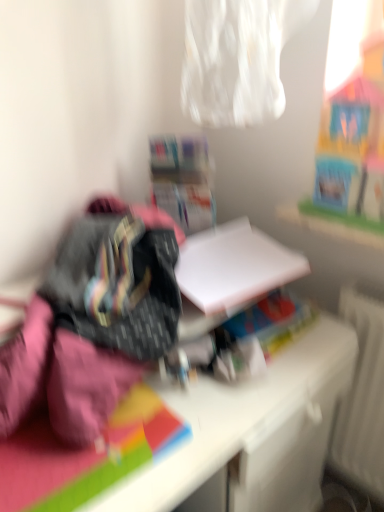
Question: Can white matte paper at center be found inside white cardboard box at center?

Choices:
 (A) no
 (B) yes

Answer: (A)

Question: Does white cardboard box at center come behind white matte paper at center?

Choices:
 (A) no
 (B) yes

Answer: (B)

Question: Does white cardboard box at center lie in front of white matte paper at center?

Choices:
 (A) yes
 (B) no

Answer: (B)

Question: Can you confirm if white cardboard box at center is bigger than white matte paper at center?

Choices:
 (A) yes
 (B) no

Answer: (A)

Question: Considering the relative sizes of white cardboard box at center and white matte paper at center in the image provided, is white cardboard box at center shorter than white matte paper at center?

Choices:
 (A) yes
 (B) no

Answer: (B)

Question: From a real-world perspective, is white cardboard box at center under white matte paper at center?

Choices:
 (A) no
 (B) yes

Answer: (A)

Question: Is white matte desk at center closer to the viewer compared to white matte paper at center?

Choices:
 (A) no
 (B) yes

Answer: (B)

Question: Considering the relative sizes of white matte desk at center and white matte paper at center in the image provided, is white matte desk at center wider than white matte paper at center?

Choices:
 (A) no
 (B) yes

Answer: (B)

Question: Could you tell me if white matte desk at center is turned towards white matte paper at center?

Choices:
 (A) yes
 (B) no

Answer: (B)

Question: Would you consider white matte desk at center to be distant from white matte paper at center?

Choices:
 (A) yes
 (B) no

Answer: (B)

Question: From a real-world perspective, is white matte desk at center on top of white matte paper at center?

Choices:
 (A) yes
 (B) no

Answer: (B)

Question: Is white matte desk at center taller than white matte paper at center?

Choices:
 (A) no
 (B) yes

Answer: (B)

Question: Can you confirm if white matte paper at center is wider than white matte desk at center?

Choices:
 (A) no
 (B) yes

Answer: (A)